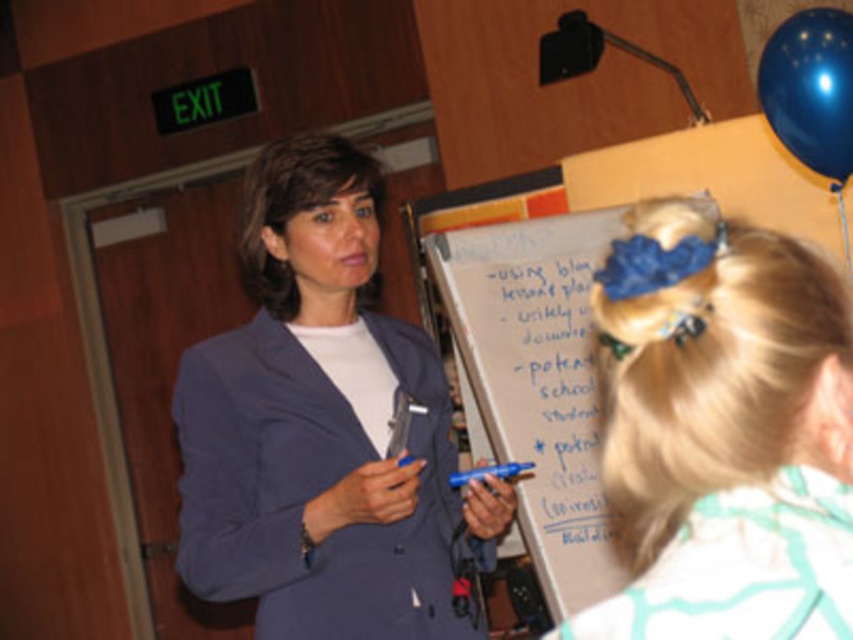
Can you confirm if whiteboard at center is taller than blue rubber balloon at upper right?

Yes, whiteboard at center is taller than blue rubber balloon at upper right.

Who is positioned more to the left, whiteboard at center or blue rubber balloon at upper right?

Positioned to the left is whiteboard at center.

Between point (556, 579) and point (775, 129), which one is positioned in front?

Positioned in front is point (775, 129).

The image size is (853, 640). I want to click on whiteboard at center, so click(537, 381).

Between matte blue blazer at center and whiteboard at center, which one is positioned higher?

matte blue blazer at center

Does matte blue blazer at center appear on the right side of whiteboard at center?

No, matte blue blazer at center is not to the right of whiteboard at center.

Identify the location of matte blue blazer at center. (322, 428).

Can you confirm if white matte hair at upper center is positioned above whiteboard at center?

Yes, white matte hair at upper center is above whiteboard at center.

Does white matte hair at upper center appear on the right side of whiteboard at center?

Incorrect, white matte hair at upper center is not on the right side of whiteboard at center.

Between point (776, 461) and point (548, 356), which one is positioned in front?

Point (776, 461) is in front.

Where is `white matte hair at upper center`? Image resolution: width=853 pixels, height=640 pixels. white matte hair at upper center is located at coordinates (722, 432).